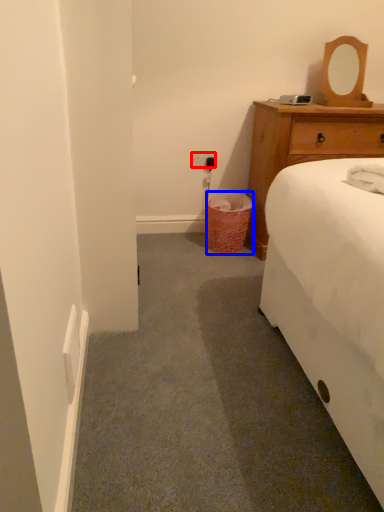
Question: Which of the following is the closest to the observer, power outlet (highlighted by a red box) or trash bin/can (highlighted by a blue box)?

Choices:
 (A) power outlet
 (B) trash bin/can

Answer: (B)